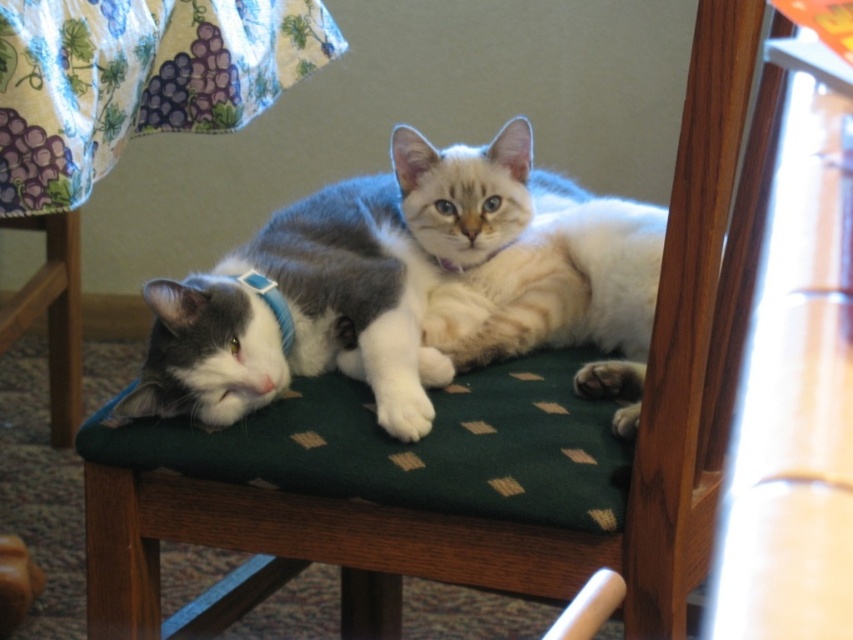
Question: Can you confirm if light brown fur at center is positioned to the right of blue fabric neckband at left?

Choices:
 (A) yes
 (B) no

Answer: (A)

Question: Which point is farther to the camera?

Choices:
 (A) gray matte fur cat at center
 (B) blue fabric neckband at left
 (C) light brown fur at center

Answer: (B)

Question: Does gray matte fur cat at center appear on the right side of blue fabric neckband at left?

Choices:
 (A) yes
 (B) no

Answer: (A)

Question: Estimate the real-world distances between objects in this image. Which object is farther from the light brown fur at center?

Choices:
 (A) blue fabric neckband at left
 (B) gray matte fur cat at center

Answer: (A)

Question: Is gray matte fur cat at center below light brown fur at center?

Choices:
 (A) no
 (B) yes

Answer: (A)

Question: Which point is closer to the camera taking this photo?

Choices:
 (A) (161, 364)
 (B) (260, 291)

Answer: (A)